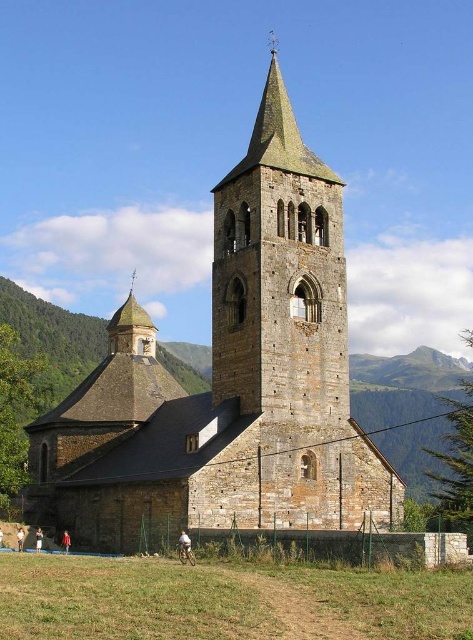
From the picture: You are standing at the coordinate point 0.5, 0.5 in the image. You want to take a photo of the brown stone church at center. Which direction should you move to get a better view?

The brown stone church at center is located at point (231, 381). Since you are at (236, 320), you should move slightly to the northeast to align with the church for a better view.

You are a drone operator trying to capture aerial footage of the brown stone church at center and the smooth stone spire at upper left. From your current position, which one would appear closer to the camera?

The brown stone church at center appears closer to the camera because it is in front of the smooth stone spire at upper left.

You are standing in front of the historic stone church and want to take a photo. You notice two points marked on the bell tower. The first point is at coordinates point (177,524) and the second is at point (150,330). Which point should you focus on if you want to capture the part of the bell tower that is closer to you?

Point (177,524) is closer to the camera than point (150,330), so you should focus on point (177,524) to capture the part of the bell tower that is closer to you.